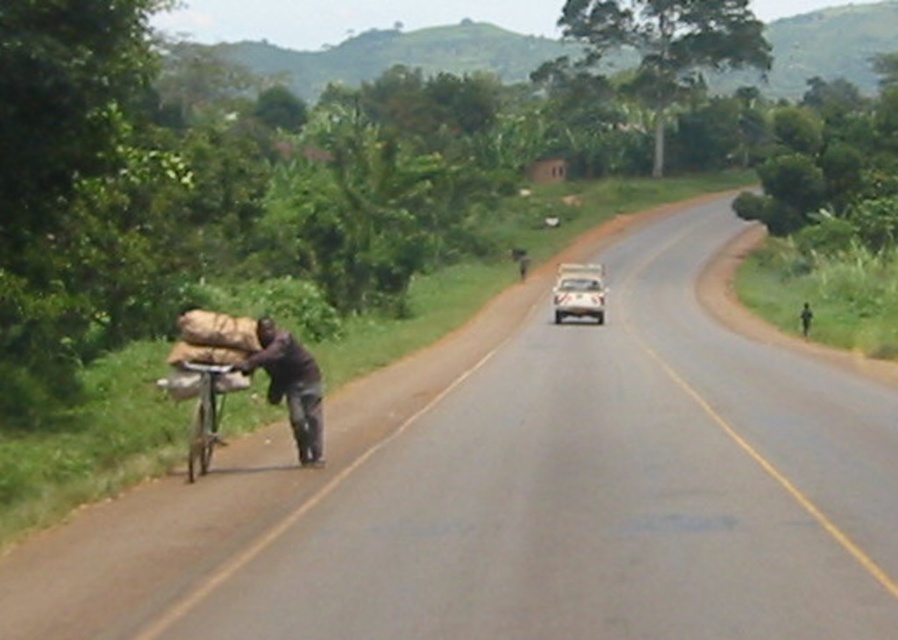
Which is in front, point (313, 436) or point (199, 365)?

Point (199, 365) is in front.

Between dark brown fabric at left and metallic silver bicycle at left, which one appears on the right side from the viewer's perspective?

Positioned to the right is dark brown fabric at left.

Does point (291, 356) come farther from viewer compared to point (217, 378)?

Yes, point (291, 356) is farther from viewer.

This screenshot has width=898, height=640. In order to click on dark brown fabric at left in this screenshot , I will do `click(291, 385)`.

Who is higher up, dark brown fabric at left or white glossy car at center?

white glossy car at center is higher up.

Locate an element on the screen. The image size is (898, 640). dark brown fabric at left is located at coordinates (291, 385).

Where is `dark brown fabric at left`? The height and width of the screenshot is (640, 898). dark brown fabric at left is located at coordinates (291, 385).

Is metallic silver bicycle at left thinner than white glossy car at center?

Indeed, metallic silver bicycle at left has a lesser width compared to white glossy car at center.

In the scene shown: Who is more forward, (239, 371) or (585, 312)?

Positioned in front is point (239, 371).

Locate an element on the screen. metallic silver bicycle at left is located at coordinates click(x=205, y=413).